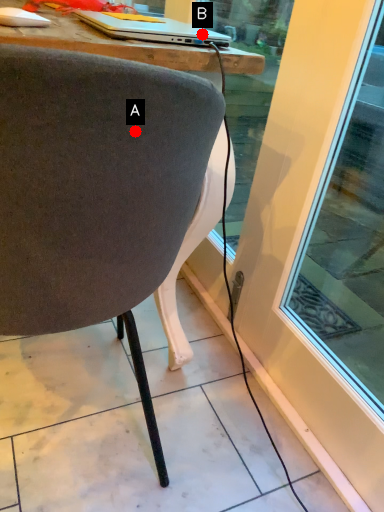
Question: Two points are circled on the image, labeled by A and B beside each circle. Which point is closer to the camera taking this photo?

Choices:
 (A) A is closer
 (B) B is closer

Answer: (A)